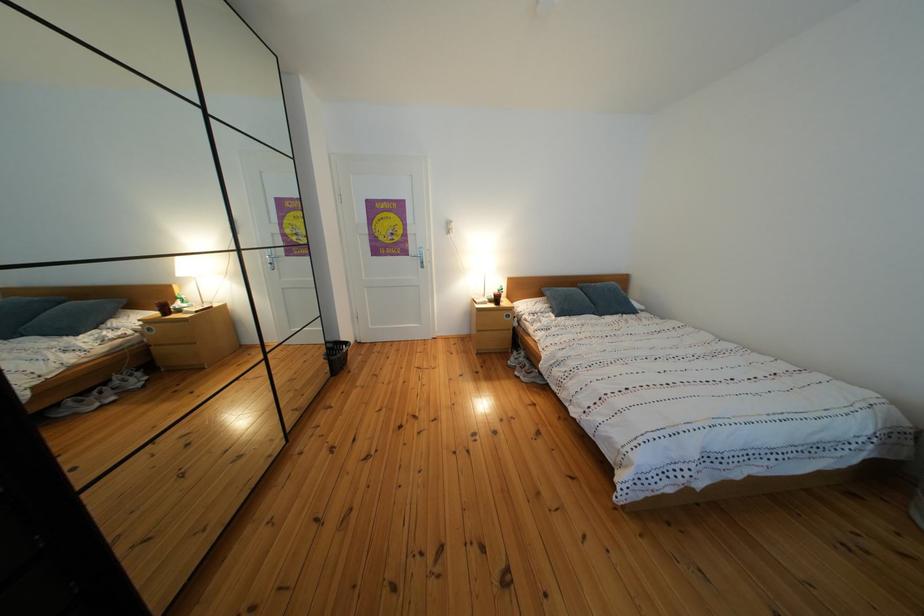
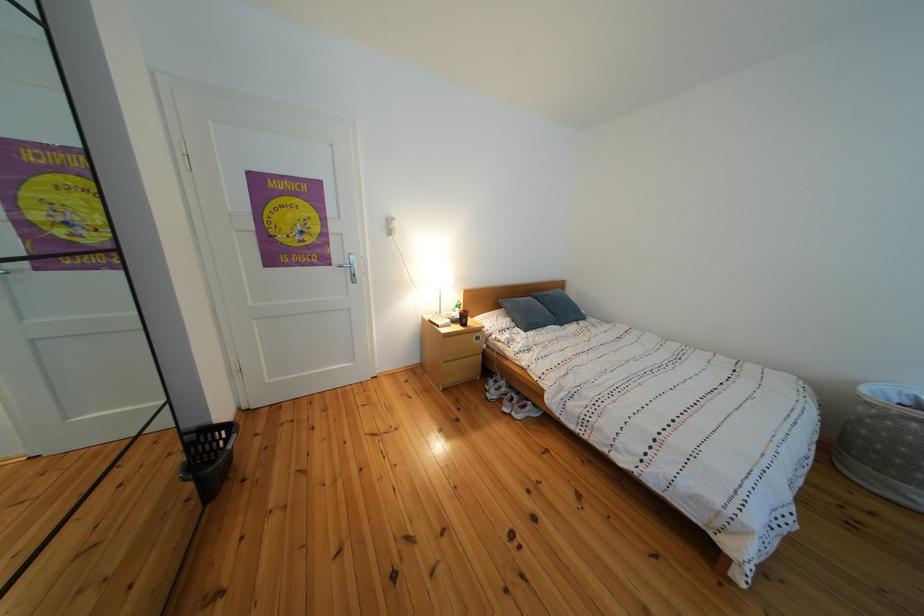
Locate, in the second image, the point that corresponds to point (558, 310) in the first image.

(519, 325)